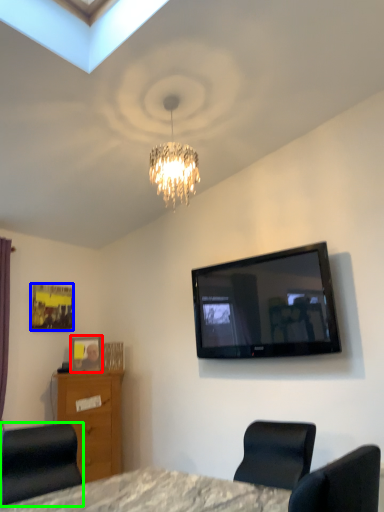
Question: Which object is the closest to the picture frame (highlighted by a red box)? Choose among these: picture frame (highlighted by a blue box) or chair (highlighted by a green box).

Choices:
 (A) picture frame
 (B) chair

Answer: (A)